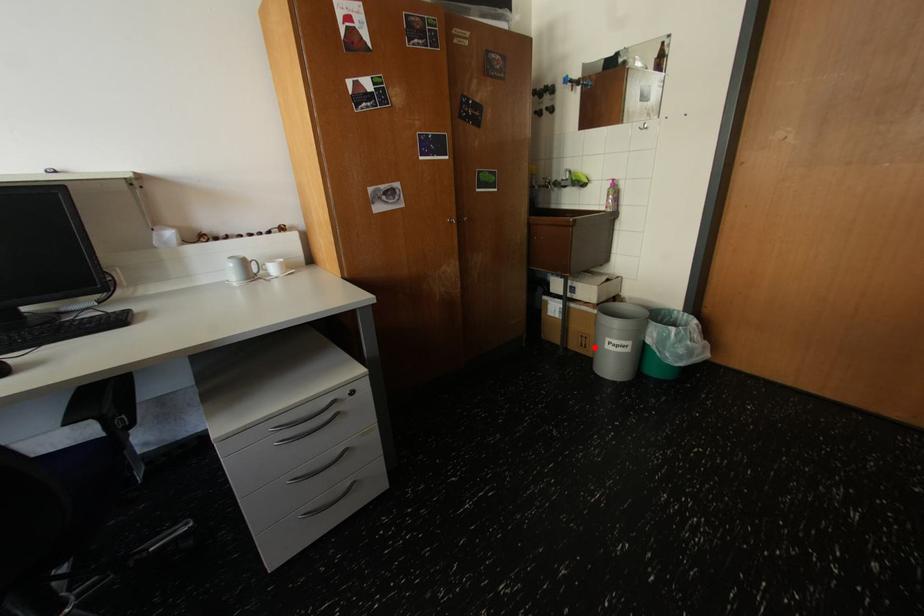
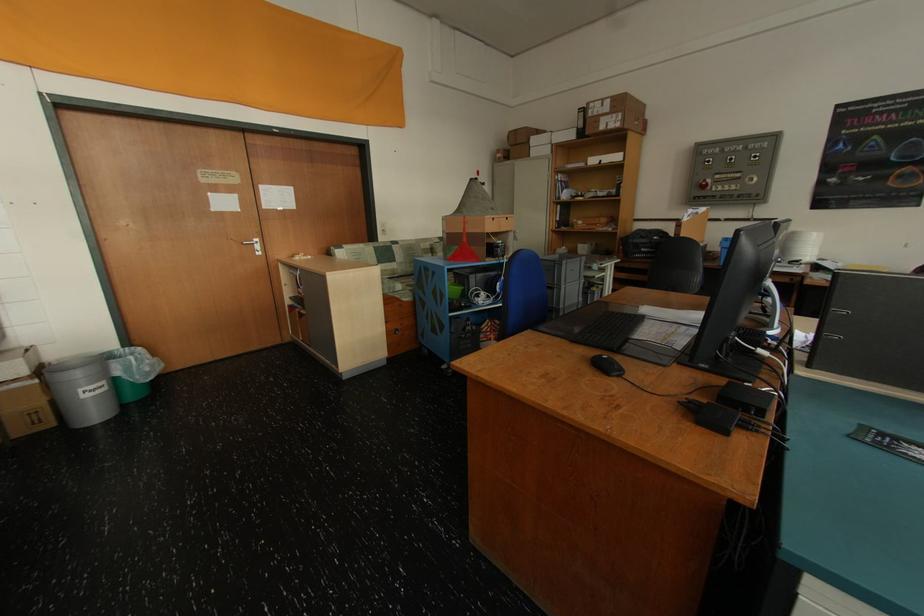
Locate, in the second image, the point that corresponds to the highlighted location in the first image.

(50, 422)